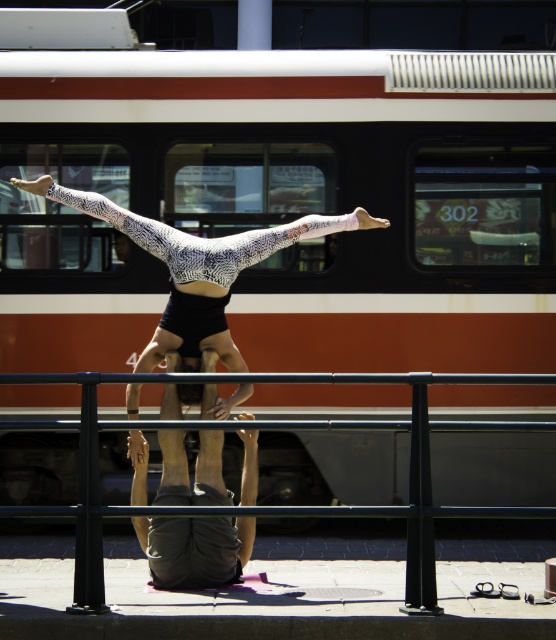
Who is lower down, black metal rail at center or dark gray fabric pants at center?

Positioned lower is dark gray fabric pants at center.

Between black metal rail at center and dark gray fabric pants at center, which one is positioned higher?

black metal rail at center is higher up.

Locate an element on the screen. black metal rail at center is located at coordinates (418, 470).

Does white textured leotard at center appear on the right side of dark gray fabric pants at center?

In fact, white textured leotard at center is to the left of dark gray fabric pants at center.

Can you confirm if white textured leotard at center is taller than dark gray fabric pants at center?

Yes, white textured leotard at center is taller than dark gray fabric pants at center.

Which is behind, point (317, 230) or point (220, 524)?

The point (317, 230) is behind.

At what (x,y) coordinates should I click in order to perform the action: click on white textured leotard at center. Please return your answer as a coordinate pair (x, y). The image size is (556, 640). Looking at the image, I should click on (196, 268).

From the picture: Who is shorter, brown/white striped train at upper center or black metal rail at center?

black metal rail at center is shorter.

Identify the location of brown/white striped train at upper center. Image resolution: width=556 pixels, height=640 pixels. (286, 204).